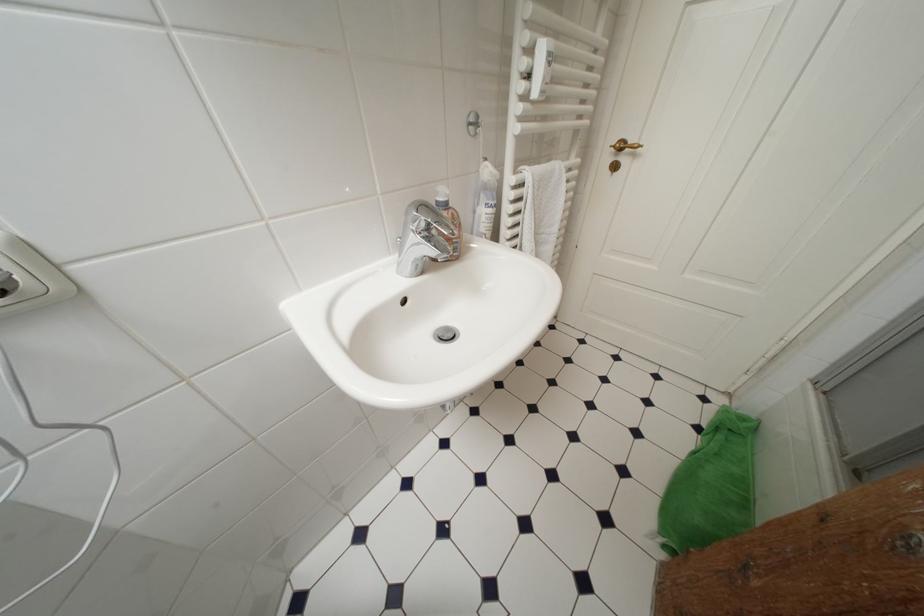
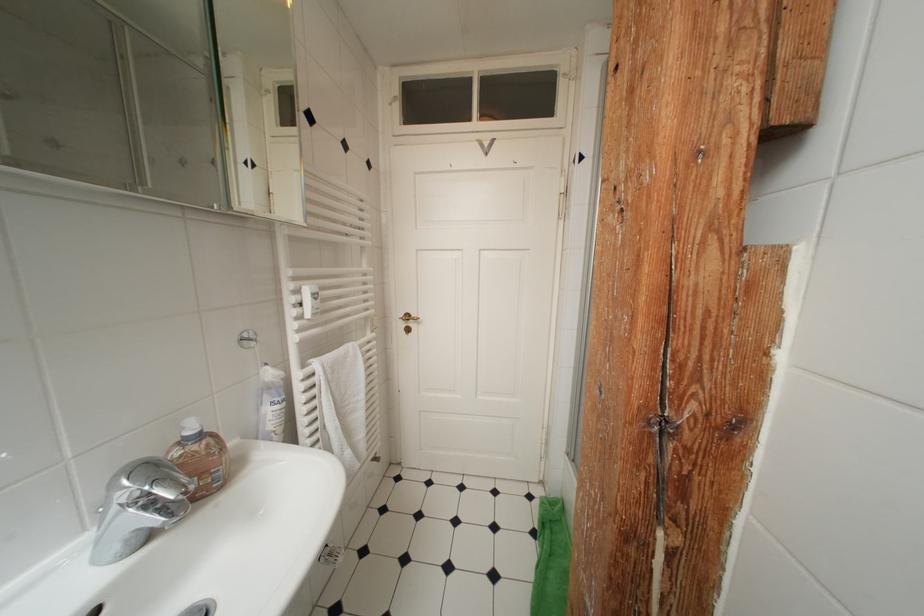
How did the camera likely rotate?

The camera rotated toward right-up.